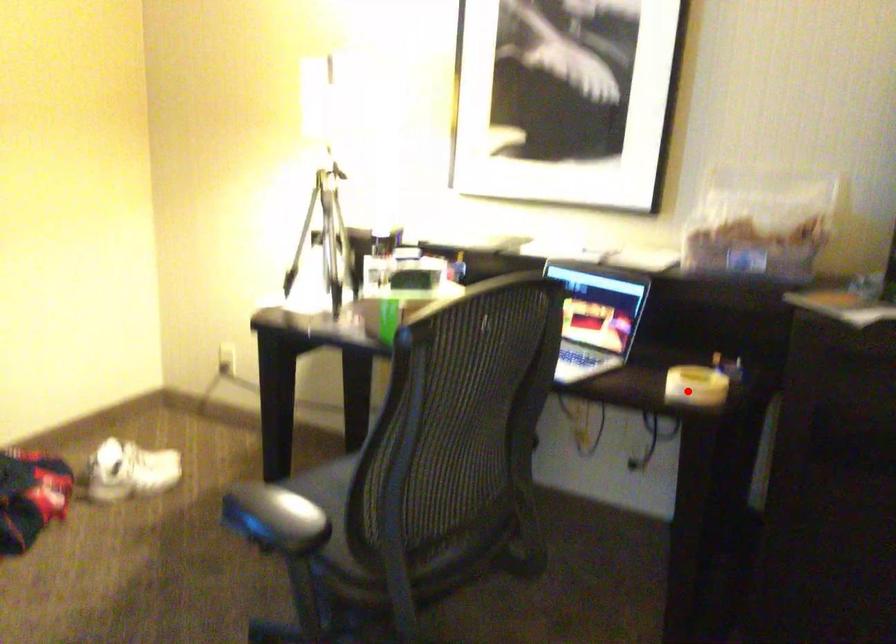
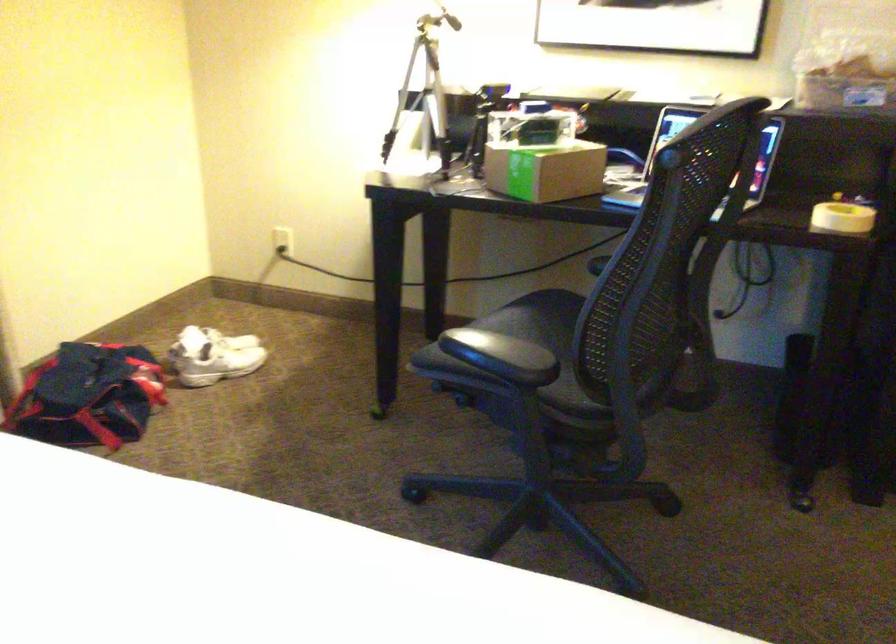
Question: I am providing you with two images of the same scene from different viewpoints. A red point is marked on the first image. Can you still see the location of the red point in image 2?

Choices:
 (A) Yes
 (B) No

Answer: (A)